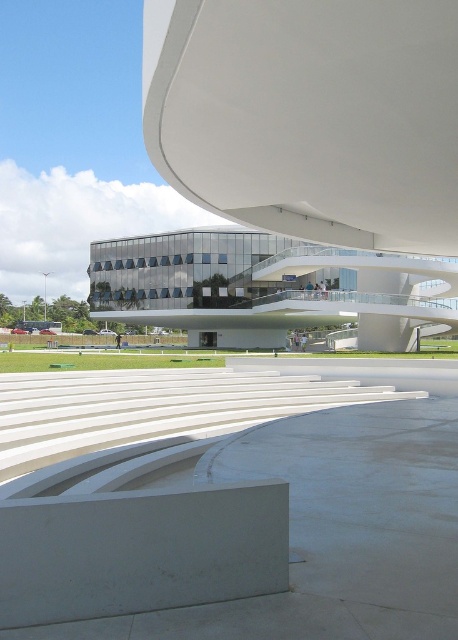
You are an architect evaluating the design of the modern structure. The white smooth amphitheater at center and transparent glass building at center are key elements. Which of these two elements has a larger size according to the design specifications?

The white smooth amphitheater at center is bigger than the transparent glass building at center, so the amphitheater is the larger element in terms of size.